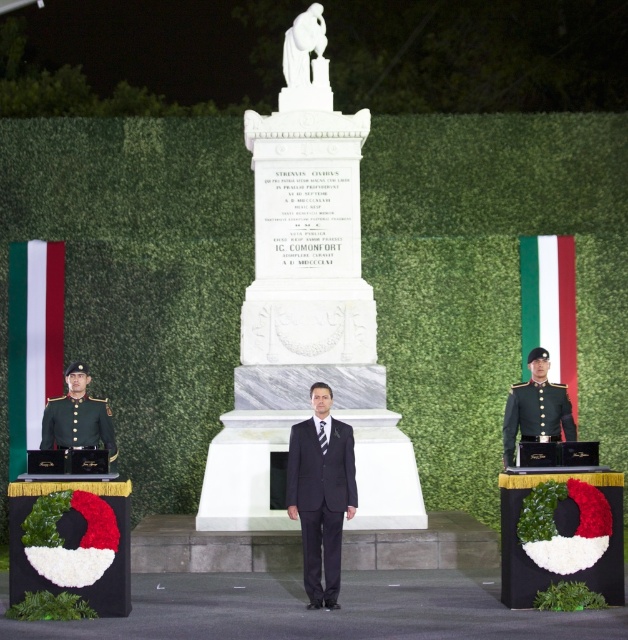
You are attending a formal event at night and see the monument with three podiums. The podiums have black and gold fabric. Which object is exactly at the coordinates point (x=320, y=493)?

The point (x=320, y=493) marks the dark gray suit at center.

You are attending the event and need to take a photo of the dark gray suit at center and the green uniform at right. Based on their positions, which one should you focus on first if you want to capture both in a single frame without moving the camera?

The dark gray suit at center is positioned on the left side of the green uniform at right, so you should focus on the dark gray suit at center first to ensure both are in the frame.